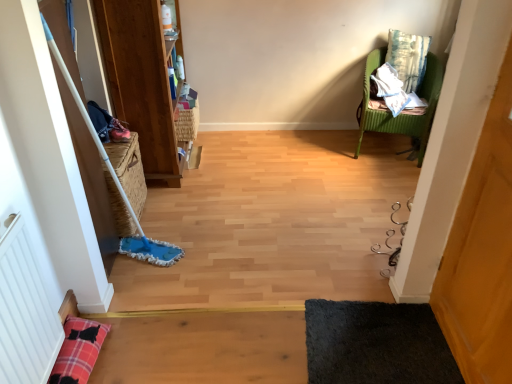
Question: Based on their sizes in the image, would you say woven brown basket at upper center, the 2th basket in the bottom-to-top sequence, is bigger or smaller than white textured radiator at lower left?

Choices:
 (A) big
 (B) small

Answer: (B)

Question: In terms of width, does woven brown basket at upper center, acting as the 2th basket starting from the front, look wider or thinner when compared to white textured radiator at lower left?

Choices:
 (A) wide
 (B) thin

Answer: (A)

Question: Which of these objects is positioned closest to the green ribbed chair at upper right?

Choices:
 (A) black shaggy rug at lower right
 (B) wooden bookshelf at left
 (C) textured blue-green pillow at upper right
 (D) white textured radiator at lower left
 (E) wooden screen door at right

Answer: (C)

Question: Which is nearer to the textured blue-green pillow at upper right?

Choices:
 (A) green ribbed chair at upper right
 (B) wooden bookshelf at left
 (C) woven straw basket at left, the second basket from the right
 (D) white textured radiator at lower left
 (E) woven brown basket at upper center, positioned as the second basket in left-to-right order

Answer: (A)